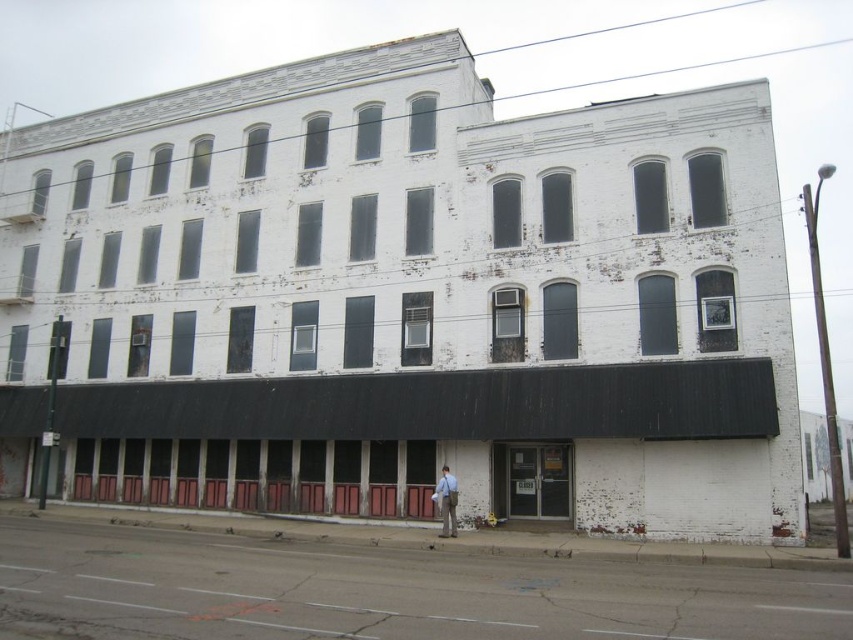
Question: Is matte glass door at lower center positioned before light brown leather jacket at center?

Choices:
 (A) no
 (B) yes

Answer: (A)

Question: Does matte glass door at lower center come behind light brown leather jacket at center?

Choices:
 (A) no
 (B) yes

Answer: (B)

Question: Which object appears closest to the camera in this image?

Choices:
 (A) matte glass door at lower center
 (B) light brown leather jacket at center

Answer: (B)

Question: Which object appears farthest from the camera in this image?

Choices:
 (A) light brown leather jacket at center
 (B) matte glass door at lower center

Answer: (B)

Question: Is the position of matte glass door at lower center more distant than that of light brown leather jacket at center?

Choices:
 (A) yes
 (B) no

Answer: (A)